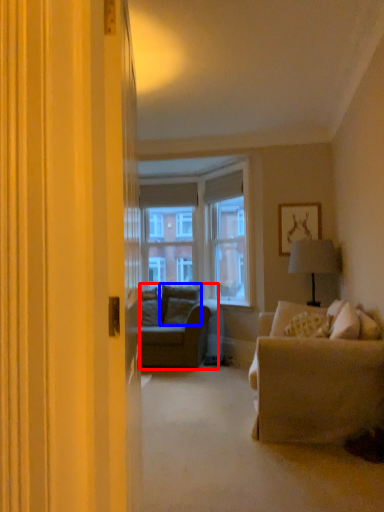
Question: Which point is further to the camera, studio couch (highlighted by a red box) or pillow (highlighted by a blue box)?

Choices:
 (A) studio couch
 (B) pillow

Answer: (B)